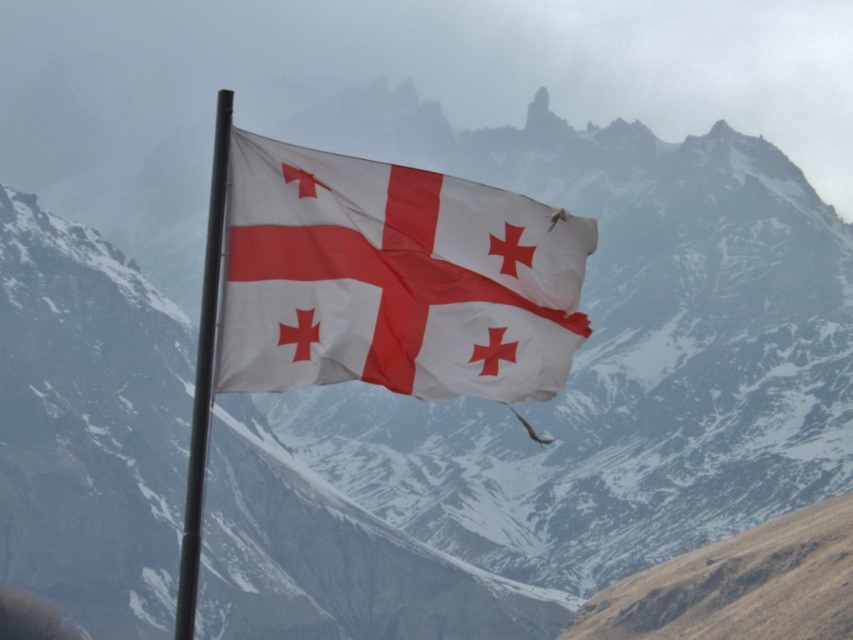
You are standing in front of the flagpole and want to touch the flag. Which object will you reach first, the white fabric flag at center or the black metal flag pole at center?

You will reach the white fabric flag at center first because it is closer to you than the black metal flag pole at center.

You are a hiker trying to locate the white fabric flag at center in the image. Based on the scene description, where would you expect to find the flag relative to the rugged, snow capped mountains in the background?

The white fabric flag at center is located at point (393, 280), which is centrally positioned in the image between the rugged, snow capped mountains in the background.

From the picture: You are a photographer trying to capture the flag and its pole in a single shot. Given that the white fabric flag at center is shorter than the black metal flag pole at center, which object will appear taller in your photo?

The black metal flag pole at center appears taller than the white fabric flag at center in the photo because the description states that the white fabric flag at center has a lesser height compared to the black metal flag pole at center.